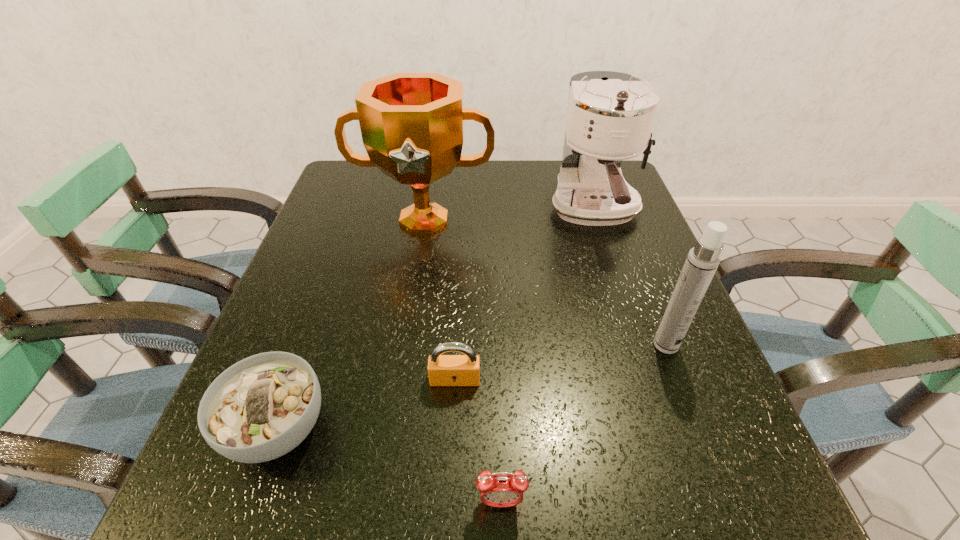
Identify the location of free space located 0.120m to unlock the padlock from the front. (451, 455).

This screenshot has width=960, height=540. I want to click on vacant point located on the right of the soup bowl, so click(x=511, y=428).

Where is `award present at the far edge`? award present at the far edge is located at coordinates pyautogui.click(x=412, y=124).

You are a GUI agent. You are given a task and a screenshot of the screen. Output one action in this format:
    pyautogui.click(x=<x>, y=<y>)
    Task: Click on the coffee maker that is at the far edge
    The height and width of the screenshot is (540, 960).
    Given the screenshot: What is the action you would take?
    pyautogui.click(x=610, y=115)

The height and width of the screenshot is (540, 960). I want to click on soup bowl that is at the near edge, so click(262, 407).

Where is `alarm clock positioned at the near edge`? Image resolution: width=960 pixels, height=540 pixels. alarm clock positioned at the near edge is located at coordinates (500, 489).

Identify the location of award that is at the left edge. (412, 124).

Where is `soup bowl present at the left edge`? soup bowl present at the left edge is located at coordinates (262, 407).

Identify the location of coffee maker located in the right edge section of the desktop. (x=610, y=115).

Find the location of `aerosol can at the right edge`. aerosol can at the right edge is located at coordinates 702,261.